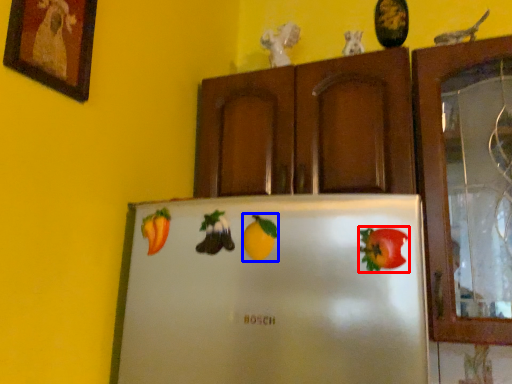
Question: Which point is further to the camera, fruit (highlighted by a red box) or fruit (highlighted by a blue box)?

Choices:
 (A) fruit
 (B) fruit

Answer: (B)